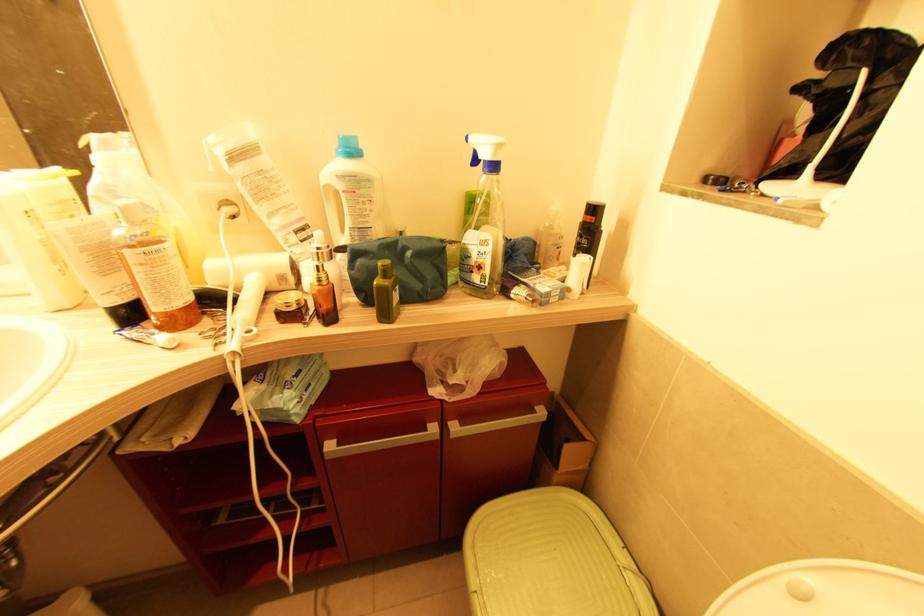
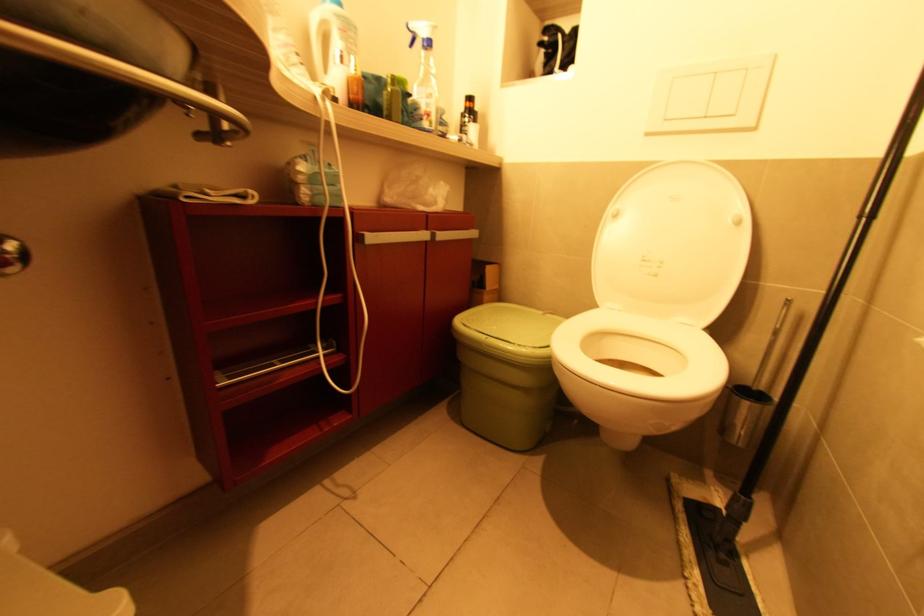
Question: The camera is either moving clockwise (left) or counter-clockwise (right) around the object. The first image is from the beginning of the video and the second image is from the end. Is the camera moving left or right when shooting the video?

Choices:
 (A) Left
 (B) Right

Answer: (A)